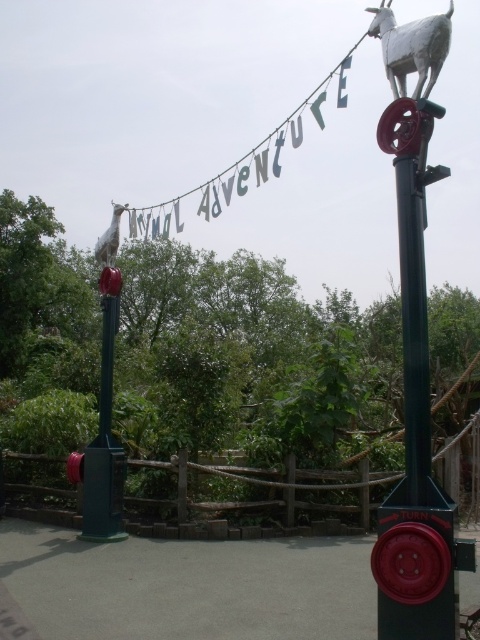
From the picture: You are a visitor at the Animal Adventure entrance and want to take a photo with both the white matte goat at upper center and the white matte goat at upper left. Which goat should you stand closer to for both to appear roughly the same size in your photo?

You should stand closer to the white matte goat at upper left since it is smaller than the white matte goat at upper center. By moving closer to the smaller goat, you can balance their apparent sizes in the photo.

You are a maintenance worker needing to reach the top of the metallic red wheel at right and the green matte post at center. Which object will require a taller ladder?

The green matte post at center requires a taller ladder because the metallic red wheel at right has a lesser height compared to it.

You are a maintenance worker who needs to replace a part on the metallic red wheel at right and the green matte post at center. Which object requires more space to work on?

The green matte post at center requires more space to work on because the metallic red wheel at right occupies less space than it.